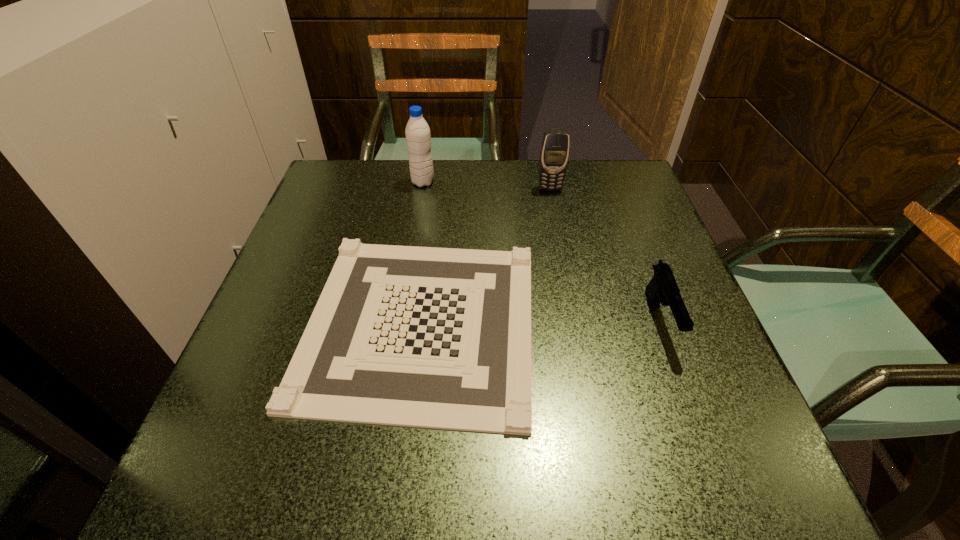
Where is `vacant space at the near right corner of the desktop`? This screenshot has height=540, width=960. vacant space at the near right corner of the desktop is located at coordinates (701, 463).

Where is `free space between the third tallest object and the second object from right to left`? free space between the third tallest object and the second object from right to left is located at coordinates (605, 254).

This screenshot has height=540, width=960. Identify the location of vacant space that is in between the cellular telephone and the tallest object. (487, 186).

Where is `vacant space that's between the checkerboard and the pistol`? vacant space that's between the checkerboard and the pistol is located at coordinates (540, 321).

Find the location of a particular element. The height and width of the screenshot is (540, 960). free space between the rightmost object and the third object from left to right is located at coordinates pos(605,254).

Locate an element on the screen. This screenshot has height=540, width=960. unoccupied area between the water bottle and the cellular telephone is located at coordinates (487, 186).

You are a GUI agent. You are given a task and a screenshot of the screen. Output one action in this format:
    pyautogui.click(x=<x>, y=<y>)
    Task: Click on the free space between the checkerboard and the pistol
    This screenshot has width=960, height=540.
    Given the screenshot: What is the action you would take?
    click(x=540, y=321)

Identify the location of free space between the pistol and the shortest object. (540, 321).

What are the coordinates of `free space between the second object from right to left and the rightmost object` in the screenshot? It's located at (605, 254).

The image size is (960, 540). I want to click on object that is the second closest to the water bottle, so click(x=554, y=154).